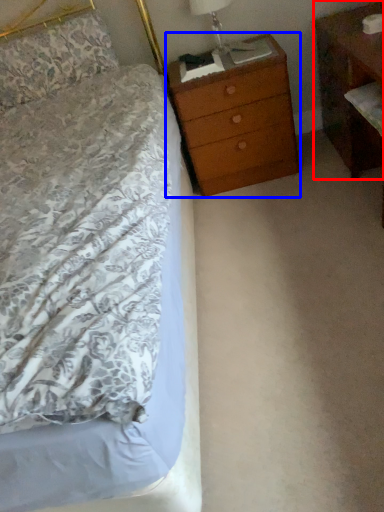
Question: Which object is further to the camera taking this photo, nightstand (highlighted by a red box) or chest of drawers (highlighted by a blue box)?

Choices:
 (A) nightstand
 (B) chest of drawers

Answer: (B)